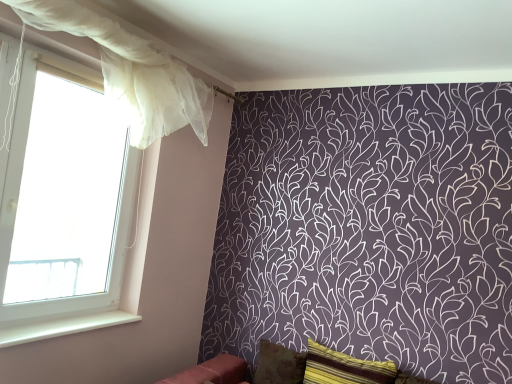
Question: Is the position of velvet red sofa at lower center more distant than that of white smooth window sill at lower left?

Choices:
 (A) no
 (B) yes

Answer: (A)

Question: Is white smooth window sill at lower left surrounded by velvet red sofa at lower center?

Choices:
 (A) yes
 (B) no

Answer: (B)

Question: Is velvet red sofa at lower center bigger than white smooth window sill at lower left?

Choices:
 (A) yes
 (B) no

Answer: (A)

Question: Would you consider velvet red sofa at lower center to be distant from white smooth window sill at lower left?

Choices:
 (A) yes
 (B) no

Answer: (B)

Question: Does velvet red sofa at lower center have a lesser height compared to white smooth window sill at lower left?

Choices:
 (A) yes
 (B) no

Answer: (B)

Question: Is velvet red sofa at lower center taller or shorter than white smooth window sill at lower left?

Choices:
 (A) tall
 (B) short

Answer: (A)

Question: In terms of size, does velvet red sofa at lower center appear bigger or smaller than white smooth window sill at lower left?

Choices:
 (A) small
 (B) big

Answer: (B)

Question: In the image, is velvet red sofa at lower center positioned in front of or behind white smooth window sill at lower left?

Choices:
 (A) front
 (B) behind

Answer: (A)

Question: Considering the relative positions of velvet red sofa at lower center and white smooth window sill at lower left in the image provided, is velvet red sofa at lower center to the left or to the right of white smooth window sill at lower left?

Choices:
 (A) left
 (B) right

Answer: (B)

Question: Considering their positions, is brown textured pillow at lower center, which is the 2th pillow from front to back, located in front of or behind white sheer curtain at left?

Choices:
 (A) front
 (B) behind

Answer: (B)

Question: Considering the relative positions of brown textured pillow at lower center, which is the 2th pillow from front to back, and white sheer curtain at left in the image provided, is brown textured pillow at lower center, which is the 2th pillow from front to back, to the left or to the right of white sheer curtain at left?

Choices:
 (A) right
 (B) left

Answer: (A)

Question: Is brown textured pillow at lower center, the first pillow viewed from the back, inside the boundaries of white sheer curtain at left, or outside?

Choices:
 (A) inside
 (B) outside

Answer: (B)

Question: Considering the positions of brown textured pillow at lower center, which is the 2th pillow from front to back, and white sheer curtain at left in the image, is brown textured pillow at lower center, which is the 2th pillow from front to back, wider or thinner than white sheer curtain at left?

Choices:
 (A) thin
 (B) wide

Answer: (B)

Question: Does point (92, 319) appear closer or farther from the camera than point (72, 175)?

Choices:
 (A) farther
 (B) closer

Answer: (B)

Question: Considering the positions of white smooth window sill at lower left and white sheer curtain at left in the image, is white smooth window sill at lower left bigger or smaller than white sheer curtain at left?

Choices:
 (A) big
 (B) small

Answer: (B)